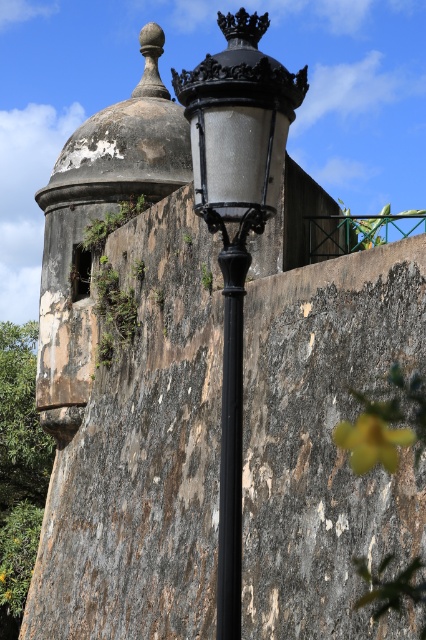
Does black metal pole at center lie in front of yellow matte flower at lower right?

Yes, it is in front of yellow matte flower at lower right.

Who is more distant from viewer, (227, 596) or (380, 428)?

The point (380, 428) is behind.

Is point (239, 516) closer to viewer compared to point (389, 444)?

Yes, point (239, 516) is closer to viewer.

You are a GUI agent. You are given a task and a screenshot of the screen. Output one action in this format:
    pyautogui.click(x=<x>, y=<y>)
    Task: Click on the black metal pole at center
    
    Given the screenshot: What is the action you would take?
    pyautogui.click(x=230, y=435)

Can you confirm if matte black lamp post at center is positioned to the right of black metal pole at center?

Incorrect, matte black lamp post at center is not on the right side of black metal pole at center.

Which is more to the right, matte black lamp post at center or black metal pole at center?

black metal pole at center is more to the right.

The image size is (426, 640). Describe the element at coordinates (236, 227) in the screenshot. I see `matte black lamp post at center` at that location.

This screenshot has width=426, height=640. Find the location of `matte black lamp post at center`. matte black lamp post at center is located at coordinates (236, 227).

Is matte black lamp post at center taller than yellow matte flower at lower right?

Indeed, matte black lamp post at center has a greater height compared to yellow matte flower at lower right.

Is point (209, 156) more distant than point (359, 458)?

No, it is in front of (359, 458).

Where is `matte black lamp post at center`? This screenshot has height=640, width=426. matte black lamp post at center is located at coordinates point(236,227).

Identify the location of matte black lamp post at center. tap(236, 227).